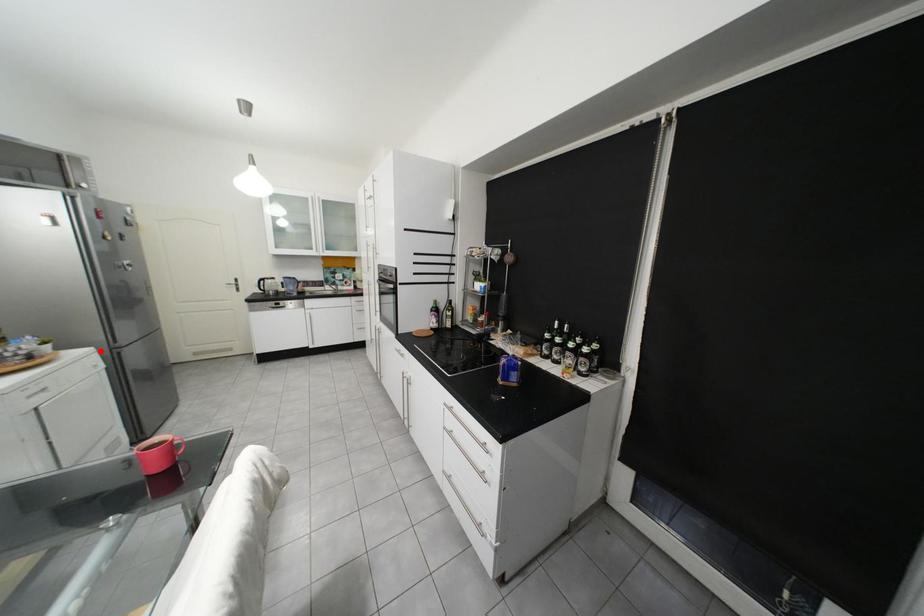
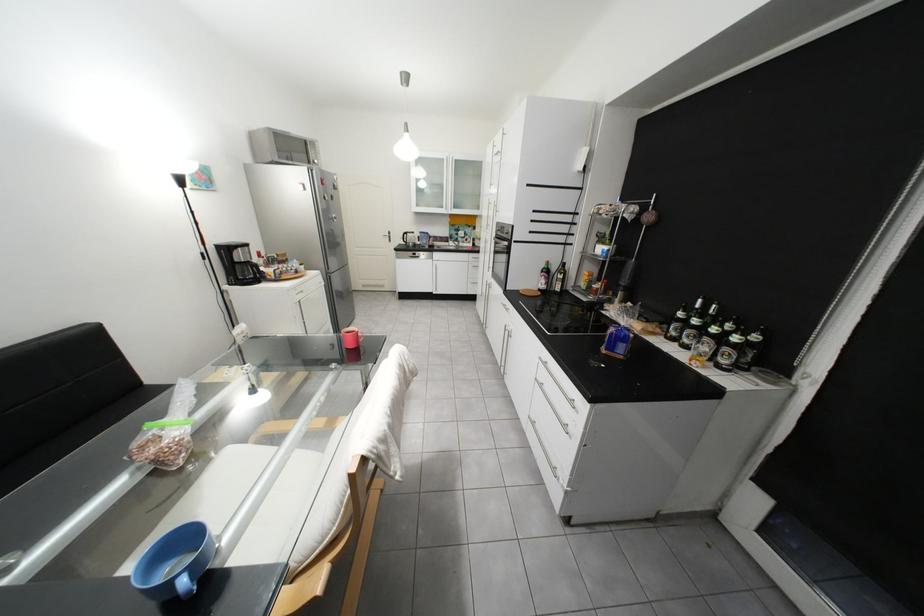
Question: I am providing you with two images of the same scene from different viewpoints. A red point is shown in image1. For the corresponding object point in image2, is it positioned nearer or farther from the camera?

Choices:
 (A) Nearer
 (B) Farther

Answer: (A)